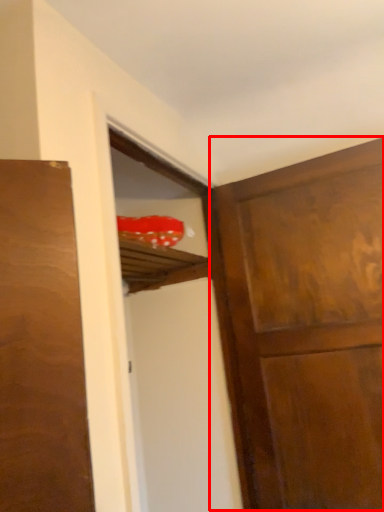
Question: Observing the image, what is the correct spatial positioning of door (annotated by the red box) in reference to screen door?

Choices:
 (A) left
 (B) right

Answer: (B)